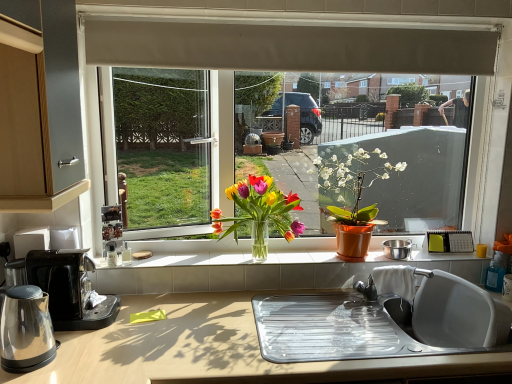
Question: From the image's perspective, is shiny metallic kettle at left above or below translucent glass vase at center, which is the 2th houseplant in right-to-left order?

Choices:
 (A) below
 (B) above

Answer: (A)

Question: Is shiny metallic kettle at left to the left or to the right of translucent glass vase at center, which is the 2th houseplant in right-to-left order, in the image?

Choices:
 (A) left
 (B) right

Answer: (A)

Question: Which object is positioned farthest from the translucent glass vase at center, which is the 2th houseplant in right-to-left order?

Choices:
 (A) shiny metallic kettle at left
 (B) black plastic coffee maker at lower left
 (C) transparent glass window at center
 (D) yellow plastic corded phone at right
 (E) beige fabric exhaust hood at upper center

Answer: (A)

Question: Which of these objects is positioned closest to the black plastic coffee maker at lower left?

Choices:
 (A) white glossy vase at center
 (B) beige fabric exhaust hood at upper center
 (C) matte orange pot at center, acting as the 1th houseplant starting from the right
 (D) yellow plastic corded phone at right
 (E) metallic stainless steel pot at center

Answer: (A)